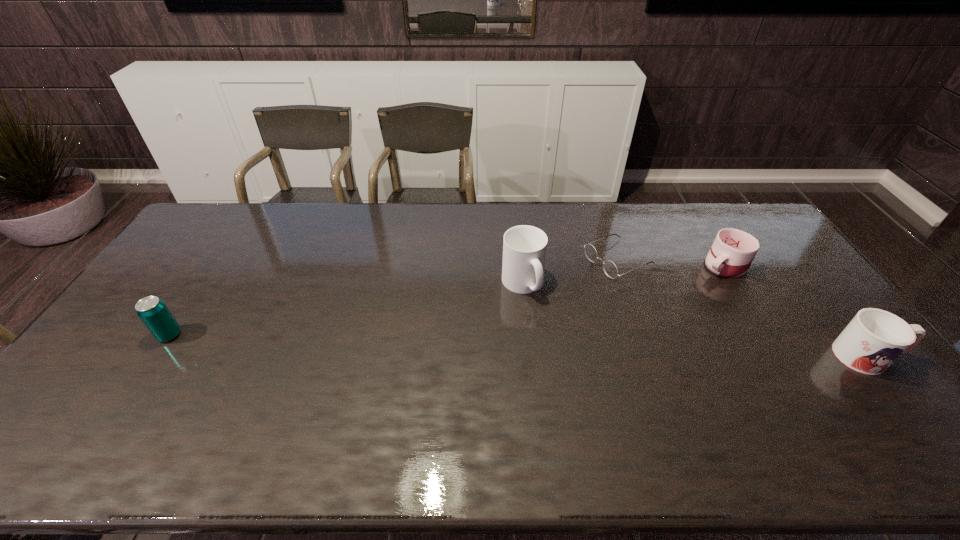
You are a GUI agent. You are given a task and a screenshot of the screen. Output one action in this format:
    pyautogui.click(x=<x>, y=<y>)
    Task: Click on the beer can
    The image size is (960, 540).
    Given the screenshot: What is the action you would take?
    pyautogui.click(x=152, y=311)

Locate an element on the screen. The image size is (960, 540). the second tallest mug is located at coordinates (874, 339).

This screenshot has width=960, height=540. In order to click on the rightmost object in this screenshot , I will do `click(874, 339)`.

The image size is (960, 540). What are the coordinates of `the tallest object` in the screenshot? It's located at (524, 247).

Find the location of a particular element. the fourth object from right to left is located at coordinates tap(524, 247).

Identify the location of the second shortest object. (733, 251).

Where is `the second mug from right to left`? This screenshot has width=960, height=540. the second mug from right to left is located at coordinates (733, 251).

The width and height of the screenshot is (960, 540). Find the location of `the shortest object`. the shortest object is located at coordinates (610, 268).

The height and width of the screenshot is (540, 960). What are the coordinates of `the third object from left to right` in the screenshot? It's located at (610, 268).

This screenshot has width=960, height=540. What are the coordinates of `vacant space situated on the back of the beer can` in the screenshot? It's located at pos(190,303).